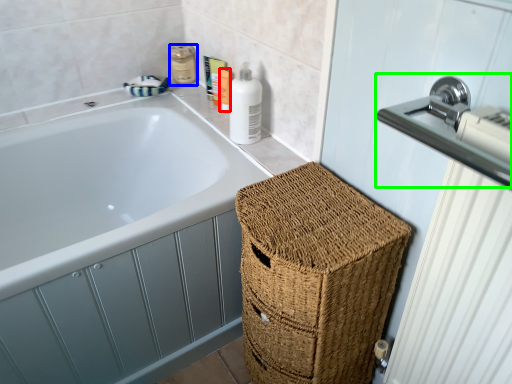
Question: Which is nearer to the toiletry (highlighted by a red box)? toiletry (highlighted by a blue box) or sink (highlighted by a green box).

Choices:
 (A) toiletry
 (B) sink

Answer: (A)